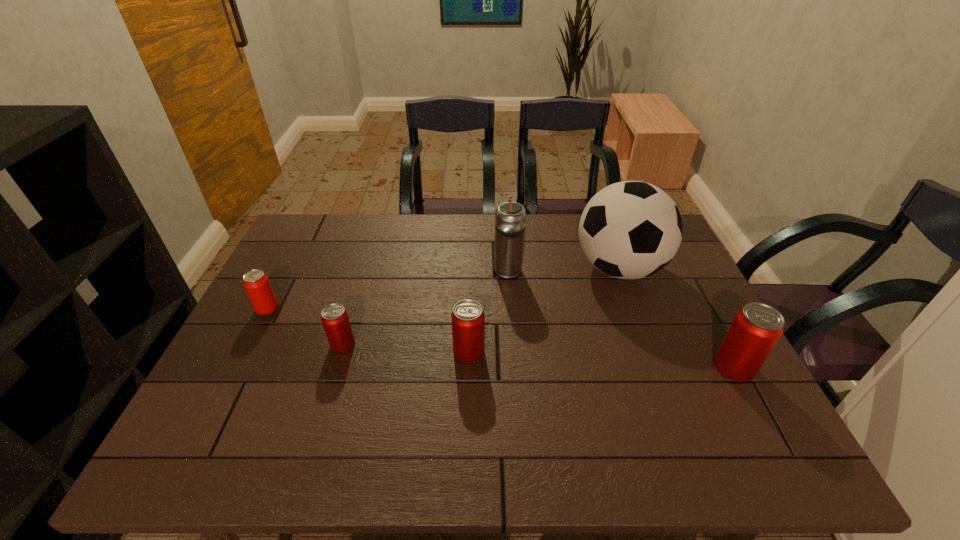
Identify the location of the shortest can. This screenshot has height=540, width=960. (335, 320).

Locate an element on the screen. the fifth object from right to left is located at coordinates (335, 320).

Identify the location of the third object from left to right. The image size is (960, 540). (468, 320).

Where is `the second can from right to left`? This screenshot has width=960, height=540. the second can from right to left is located at coordinates (468, 320).

The height and width of the screenshot is (540, 960). I want to click on the rightmost can, so click(756, 329).

I want to click on the tallest can, so click(x=756, y=329).

The image size is (960, 540). Find the location of `the tallest object`. the tallest object is located at coordinates (629, 230).

Image resolution: width=960 pixels, height=540 pixels. Find the location of `soccer ball`. soccer ball is located at coordinates (629, 230).

This screenshot has width=960, height=540. Find the location of `the fourth object from left to right`. the fourth object from left to right is located at coordinates (510, 217).

Where is `the second tallest object`? Image resolution: width=960 pixels, height=540 pixels. the second tallest object is located at coordinates (510, 217).